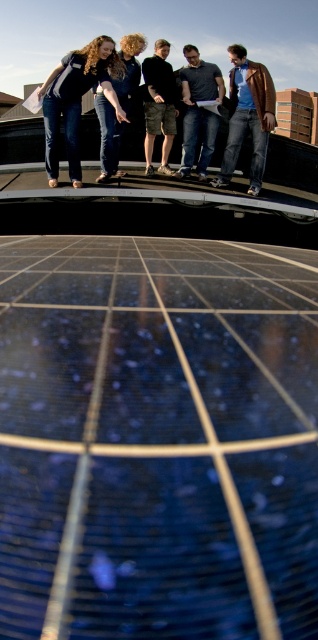
Is brown leather jacket at upper right shorter than curly hair at center?

Correct, brown leather jacket at upper right is not as tall as curly hair at center.

Is point (244, 96) closer to viewer compared to point (117, 131)?

Yes, point (244, 96) is closer to viewer.

Locate an element on the screen. This screenshot has height=640, width=318. brown leather jacket at upper right is located at coordinates (248, 116).

Is the position of brown leather jacket at upper right less distant than that of dark gray shirt at center?

Yes, brown leather jacket at upper right is in front of dark gray shirt at center.

Which is below, brown leather jacket at upper right or dark gray shirt at center?

brown leather jacket at upper right

Between point (236, 83) and point (207, 148), which one is positioned in front?

Positioned in front is point (236, 83).

This screenshot has width=318, height=640. I want to click on brown leather jacket at upper right, so click(248, 116).

Who is positioned more to the left, denim jeans at center or camouflage shorts at center?

From the viewer's perspective, denim jeans at center appears more on the left side.

Which is in front, point (82, 83) or point (175, 108)?

Point (82, 83) is in front.

Identify the location of denim jeans at center. (76, 100).